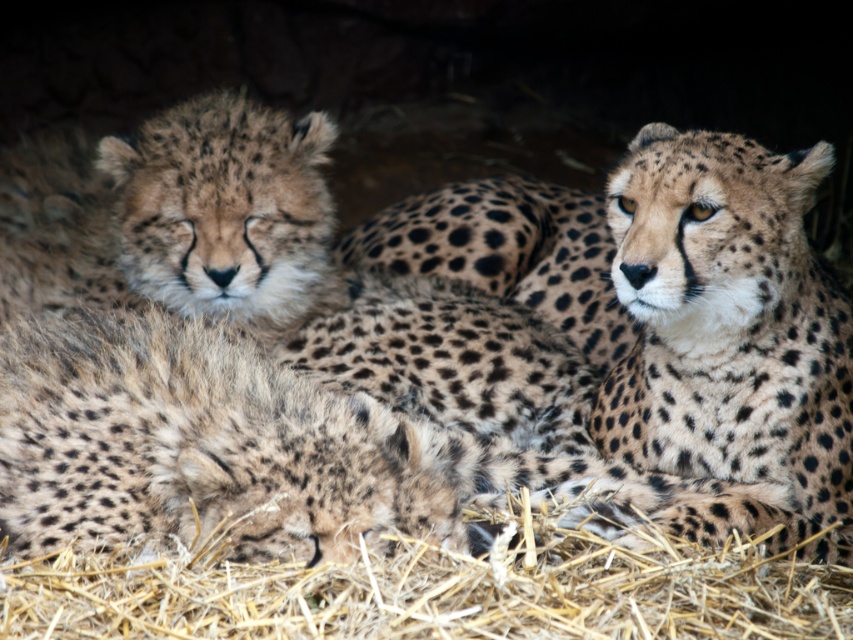
Is spotted fur cheetah at upper right thinner than brown straw at lower center?

Indeed, spotted fur cheetah at upper right has a lesser width compared to brown straw at lower center.

Does spotted fur cheetah at upper right have a larger size compared to brown straw at lower center?

Yes, spotted fur cheetah at upper right is bigger than brown straw at lower center.

Is point (842, 368) farther from camera compared to point (595, 582)?

That is True.

Image resolution: width=853 pixels, height=640 pixels. In order to click on spotted fur cheetah at upper right in this screenshot , I will do `click(730, 339)`.